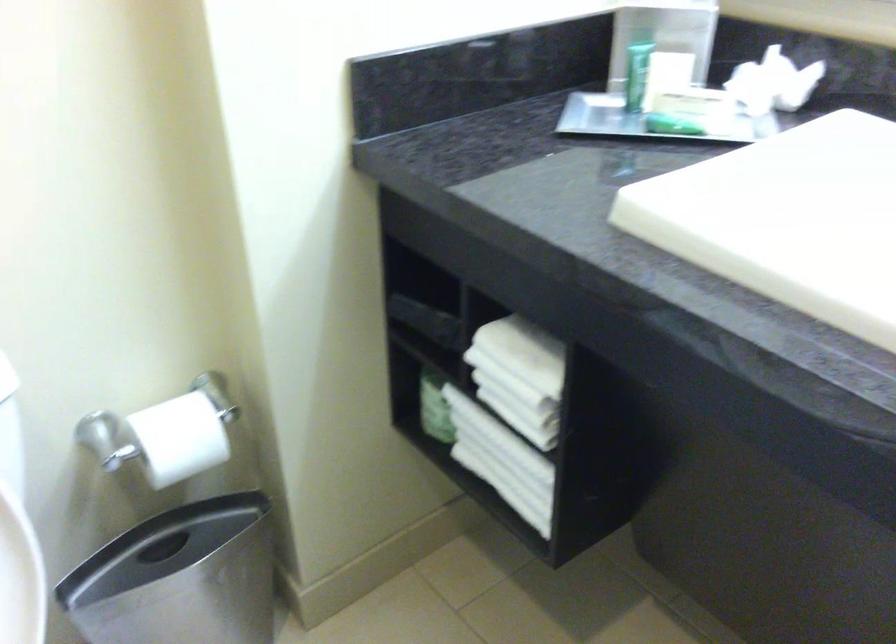
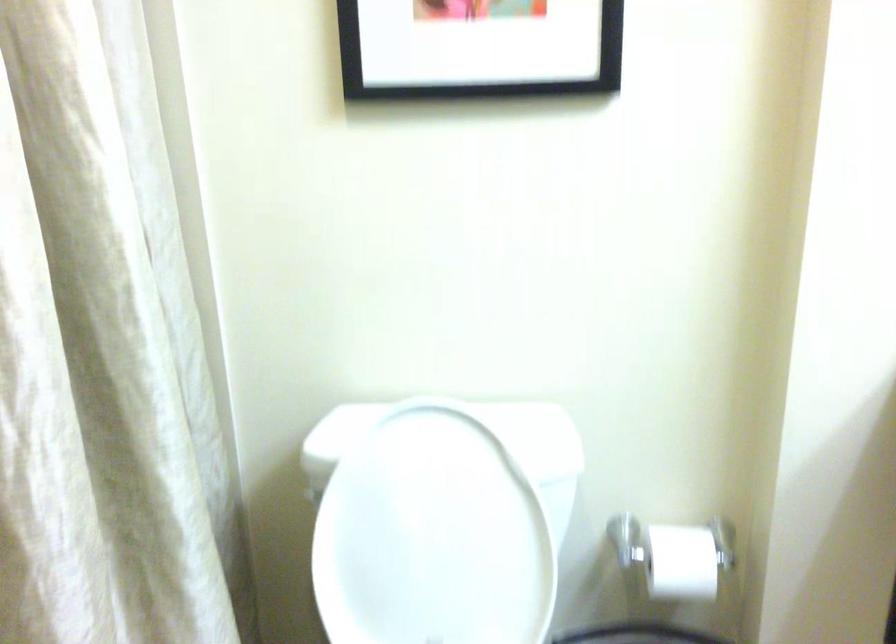
Where in the second image is the point corresponding to (185,438) from the first image?

(682, 562)